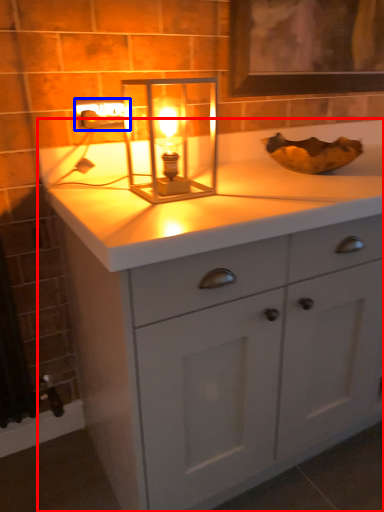
Question: Among these objects, which one is farthest to the camera, bathroom cabinet (highlighted by a red box) or electric outlet (highlighted by a blue box)?

Choices:
 (A) bathroom cabinet
 (B) electric outlet

Answer: (B)